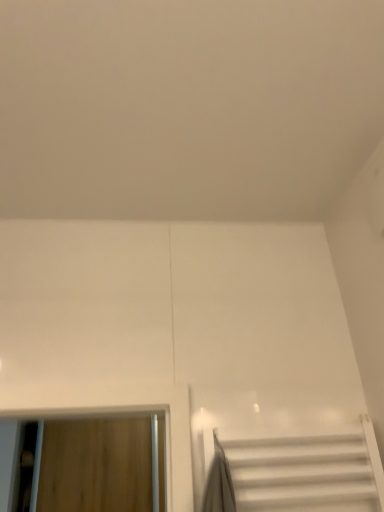
Question: Based on their sizes in the image, would you say white glossy stairs at lower right is bigger or smaller than wooden door at left?

Choices:
 (A) small
 (B) big

Answer: (A)

Question: Do you think white glossy stairs at lower right is within wooden door at left, or outside of it?

Choices:
 (A) outside
 (B) inside

Answer: (A)

Question: Visually, is white glossy stairs at lower right positioned to the left or to the right of wooden door at left?

Choices:
 (A) left
 (B) right

Answer: (B)

Question: In the image, is wooden door at left positioned in front of or behind white glossy stairs at lower right?

Choices:
 (A) behind
 (B) front

Answer: (A)

Question: In terms of size, does wooden door at left appear bigger or smaller than white glossy stairs at lower right?

Choices:
 (A) big
 (B) small

Answer: (A)

Question: Is wooden door at left taller or shorter than white glossy stairs at lower right?

Choices:
 (A) tall
 (B) short

Answer: (A)

Question: Is wooden door at left to the left or to the right of white glossy stairs at lower right in the image?

Choices:
 (A) right
 (B) left

Answer: (B)